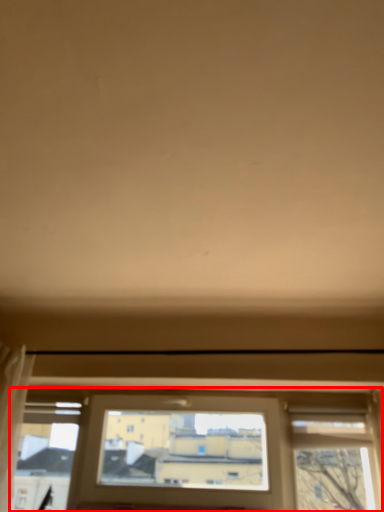
Question: Considering the relative positions of window (annotated by the red box) and curtain in the image provided, where is window (annotated by the red box) located with respect to the staircase?

Choices:
 (A) left
 (B) right

Answer: (B)